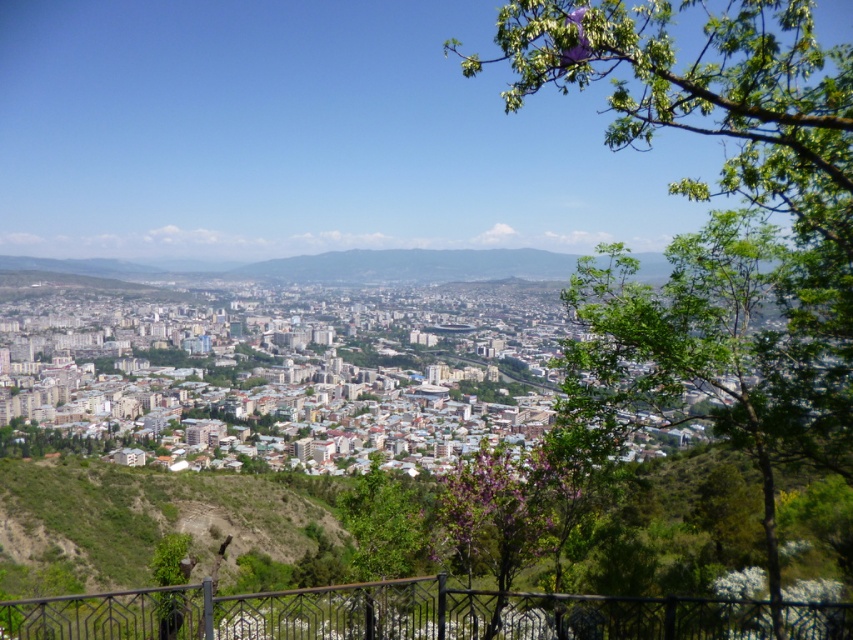
Question: Is black metal railing at lower center smaller than purple leafy tree at center?

Choices:
 (A) no
 (B) yes

Answer: (A)

Question: Which point is closer to the camera?

Choices:
 (A) (393, 492)
 (B) (827, 628)

Answer: (B)

Question: Can you confirm if green leafy tree at center is smaller than green leafy tree at lower left?

Choices:
 (A) no
 (B) yes

Answer: (A)

Question: Which object is the farthest from the purple leafy tree at center?

Choices:
 (A) green leafy tree at lower left
 (B) black metal railing at lower center

Answer: (A)

Question: Observing the image, what is the correct spatial positioning of black metal railing at lower center in reference to green leafy tree at lower left?

Choices:
 (A) left
 (B) right

Answer: (B)

Question: Which object is farther from the camera taking this photo?

Choices:
 (A) green leafy tree at center
 (B) green leafy tree at lower left

Answer: (A)